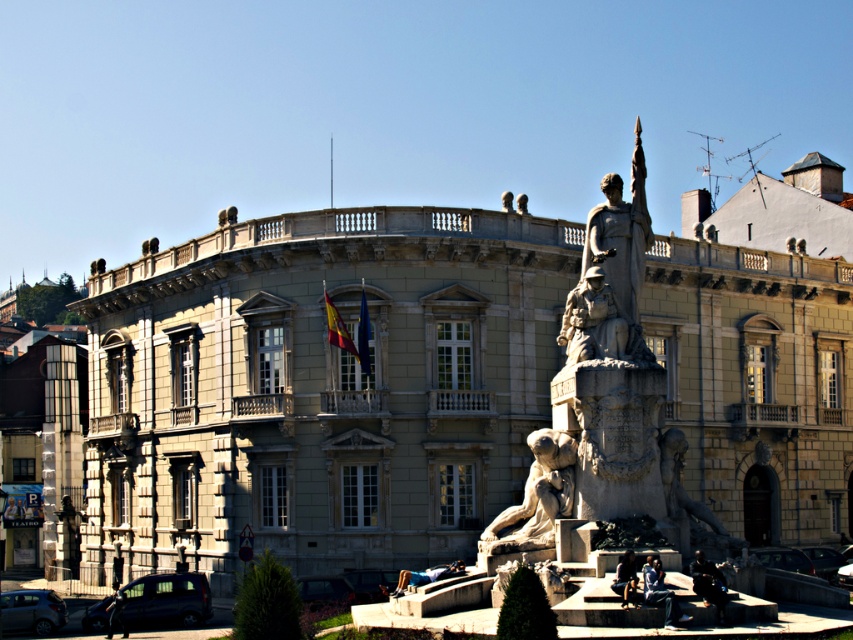
You are standing in front of the grand classical building and notice both the stone building at center and the stone lion at center. Which one is positioned higher in the scene?

The stone building at center is positioned higher than the stone lion at center because it is located above it according to the description.

You are standing at the entrance of the grand classical building. You want to find the statue located at point (320, 387). Which direction should you walk to reach it?

The stone building at center is located at point (320, 387), so you should walk towards the stone building at center to reach the statue.